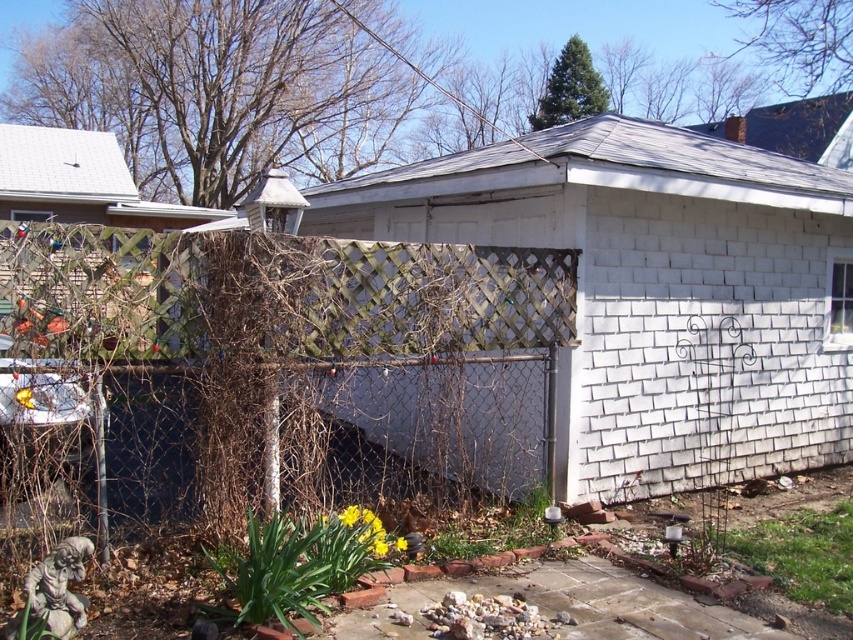
You are a gardener who wants to place a new plant pot that is 1 meter in diameter between the wooden lattice fence at left and the yellow matte flower at lower center. Will there be enough space for the pot to fit without touching either object?

The distance between the wooden lattice fence at left and the yellow matte flower at lower center is 1.14 meters. Since the pot is 1 meter in diameter, there is enough space as 1.14 meters is greater than 1 meter.

You are planning to place a new decorative item in your backyard. You have a rectangular planter that is 1.2 meters wide. You want to place it between the wooden lattice fence at left and the yellow matte flower at lower center. Will the planter fit in the space between them?

The wooden lattice fence at left is wider than the yellow matte flower at lower center. However, the question is about the space between them, not their widths. Since the exact distance between them isn